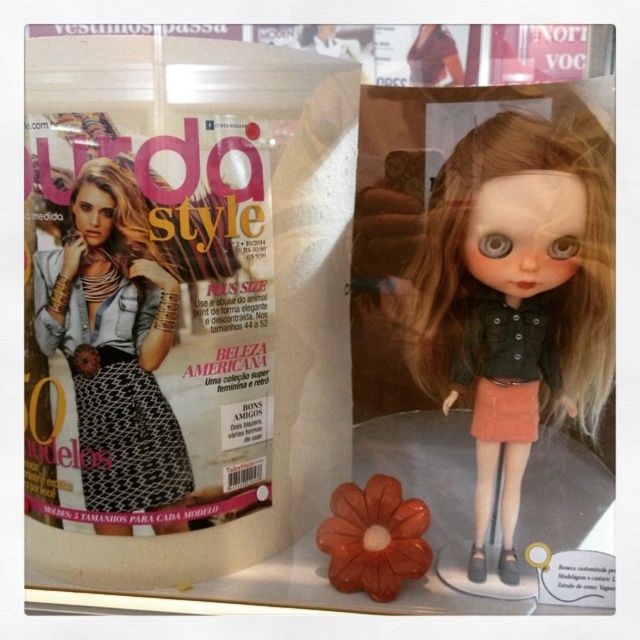
Does matte black dress at center appear under rubber-like flower at center?

Incorrect, matte black dress at center is not positioned below rubber-like flower at center.

Between point (477, 396) and point (385, 477), which one is positioned behind?

Positioned behind is point (385, 477).

Identify the location of matte black dress at center. The width and height of the screenshot is (640, 640). (506, 364).

Does matte black doll at center come behind matte black dress at center?

No, it is not.

The height and width of the screenshot is (640, 640). Describe the element at coordinates (513, 298) in the screenshot. I see `matte black doll at center` at that location.

Where is `matte black doll at center`? The width and height of the screenshot is (640, 640). matte black doll at center is located at coordinates (513, 298).

Does point (67, 339) come farther from viewer compared to point (504, 365)?

That is False.

Who is more distant from viewer, (97, 368) or (445, 410)?

The point (445, 410) is behind.

This screenshot has height=640, width=640. In order to click on black textured dress at center in this screenshot , I will do `click(116, 387)`.